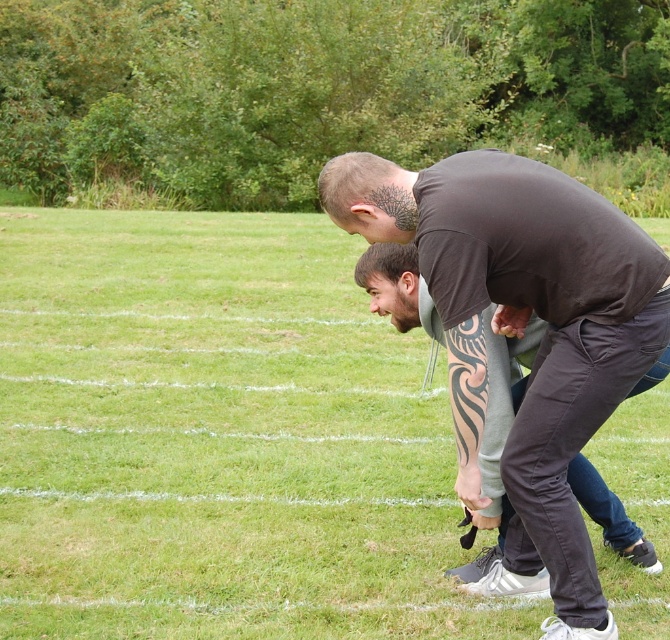
Does point (13, 468) come closer to viewer compared to point (604, 525)?

No, (13, 468) is further to viewer.

Between green grass at center and dark brown t-shirt at center, which one is positioned lower?

dark brown t-shirt at center is lower down.

At what (x,y) coordinates should I click in order to perform the action: click on green grass at center. Please return your answer as a coordinate pair (x, y). This screenshot has width=670, height=640. Looking at the image, I should click on (218, 438).